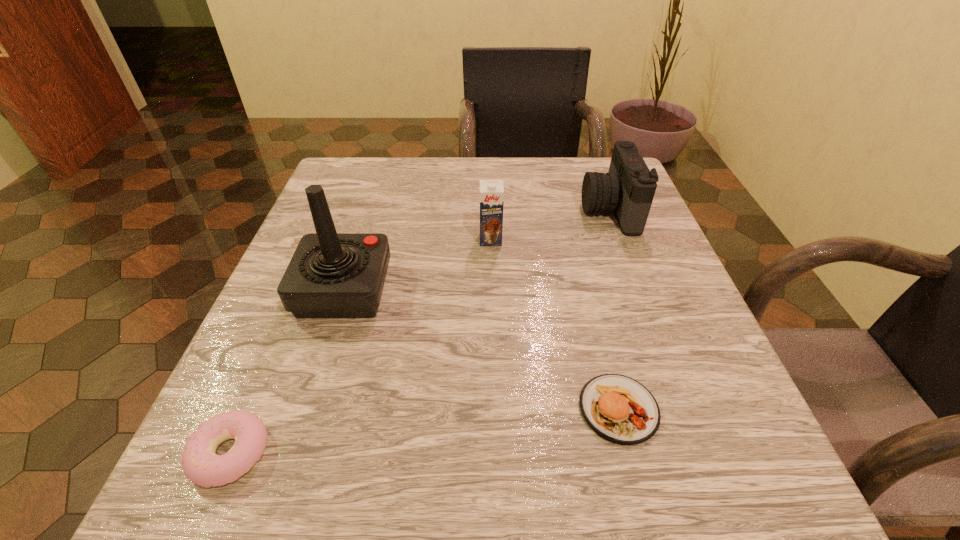
You are a GUI agent. You are given a task and a screenshot of the screen. Output one action in this format:
    pyautogui.click(x=<x>, y=<y>)
    Task: Click on the object that is at the near left corner
    
    Given the screenshot: What is the action you would take?
    pyautogui.click(x=201, y=465)

Where is `object present at the far right corner`? The image size is (960, 540). object present at the far right corner is located at coordinates (628, 189).

This screenshot has height=540, width=960. In order to click on object that is at the near right corner in this screenshot , I will do `click(618, 408)`.

This screenshot has height=540, width=960. Find the location of `free location at the far edge`. free location at the far edge is located at coordinates (448, 206).

This screenshot has height=540, width=960. In the image, there is a desktop. Identify the location of vacant space at the near edge. (341, 479).

Locate an element on the screen. This screenshot has height=540, width=960. blank space at the left edge is located at coordinates (259, 380).

Locate an element on the screen. vacant area at the right edge is located at coordinates [x=720, y=355].

Where is `blank area at the far left corner`? The width and height of the screenshot is (960, 540). blank area at the far left corner is located at coordinates (383, 193).

Where is `vacant space at the far right corner of the desktop`? The width and height of the screenshot is (960, 540). vacant space at the far right corner of the desktop is located at coordinates (569, 174).

Where is `vacant space that's between the doughnut and the joystick`? This screenshot has width=960, height=540. vacant space that's between the doughnut and the joystick is located at coordinates (287, 372).